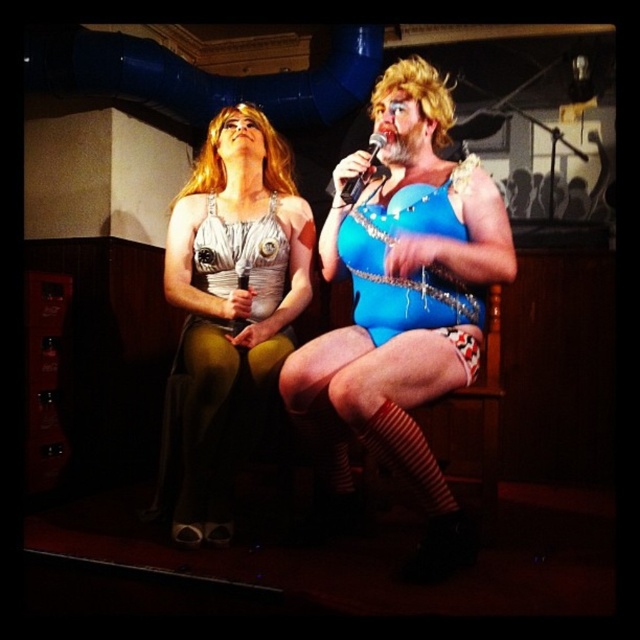
Question: Does matte silver dress at center have a smaller size compared to yellow spandex tights at center?

Choices:
 (A) yes
 (B) no

Answer: (B)

Question: Which is nearer to the matte silver dress at center?

Choices:
 (A) white dotted fabric at lower center
 (B) yellow spandex tights at center
 (C) blue shiny bodysuit at center
 (D) black metallic microphone at upper center

Answer: (B)

Question: Which of the following is the closest to the observer?

Choices:
 (A) (465, 365)
 (B) (234, 400)
 (C) (380, 134)
 (D) (342, 500)

Answer: (A)

Question: Is yellow spandex tights at center to the right of white dotted fabric at lower center from the viewer's perspective?

Choices:
 (A) yes
 (B) no

Answer: (B)

Question: Is blue shiny bodysuit at center below matte silver dress at center?

Choices:
 (A) no
 (B) yes

Answer: (B)

Question: Which object appears farthest from the camera in this image?

Choices:
 (A) blue shiny bodysuit at center
 (B) matte silver dress at center
 (C) black metallic microphone at upper center

Answer: (B)